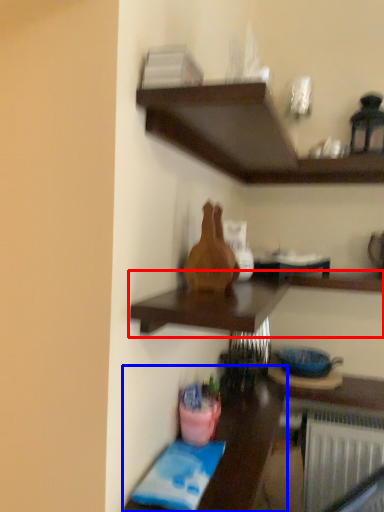
Question: Among these objects, which one is farthest to the camera, shelf (highlighted by a red box) or table (highlighted by a blue box)?

Choices:
 (A) shelf
 (B) table

Answer: (B)